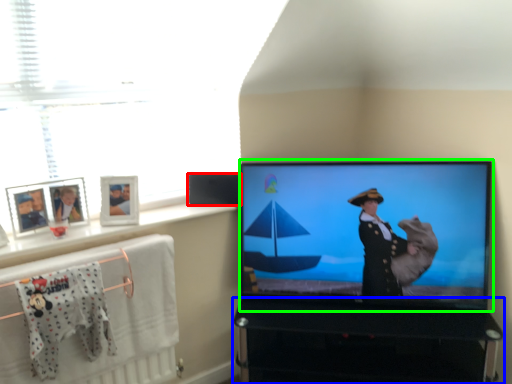
Question: Which object is positioned farthest from speaker (highlighted by a red box)? Select from furniture (highlighted by a blue box) and television (highlighted by a green box).

Choices:
 (A) furniture
 (B) television

Answer: (A)